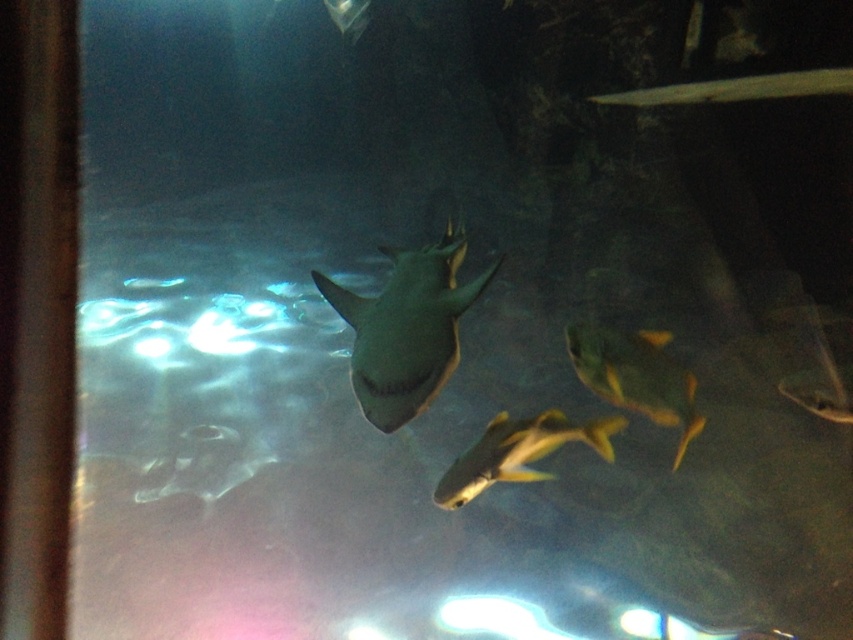
You are an underwater photographer aiming to capture a closeup of the shiny gray shark at center and the shiny yellow fish at center. Your camera has a maximum focus range of 50 centimeters. Can you photograph both subjects at the same time without moving the camera?

The distance between the shiny gray shark at center and the shiny yellow fish at center is 48.57 centimeters, which is within the camera maximum focus range of 50 centimeters. Therefore, you can photograph both subjects at the same time without moving the camera.

You are an underwater explorer looking at the aquarium through the glass surface. You notice two points marked in the image. Which point is closer to you, point (337, 284) or point (625, 406)?

Point (337, 284) is closer to you than point (625, 406) because it is further to the viewer.

You are an underwater photographer aiming to capture a clear shot of both the shiny gray shark at center and the shiny yellow fish at center. Since the shark is closer to the camera, will its height block the view of the smaller fish behind it?

The shiny gray shark at center is taller than the shiny yellow fish at center. Since the shark is closer to the camera, it will block the view of the smaller fish behind it.